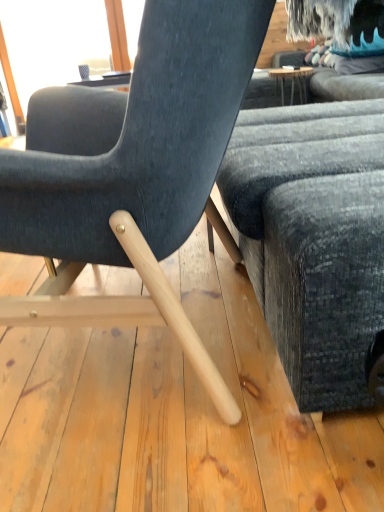
Question: Can you confirm if dark gray fabric couch at right is bigger than velvet dark blue chair at center?

Choices:
 (A) no
 (B) yes

Answer: (B)

Question: From the image's perspective, is dark gray fabric couch at right on velvet dark blue chair at center?

Choices:
 (A) yes
 (B) no

Answer: (A)

Question: Is dark gray fabric couch at right smaller than velvet dark blue chair at center?

Choices:
 (A) no
 (B) yes

Answer: (A)

Question: Is dark gray fabric couch at right taller than velvet dark blue chair at center?

Choices:
 (A) yes
 (B) no

Answer: (B)

Question: Does dark gray fabric couch at right appear on the left side of velvet dark blue chair at center?

Choices:
 (A) no
 (B) yes

Answer: (A)

Question: Is dark gray fabric couch at right outside of velvet dark blue chair at center?

Choices:
 (A) no
 (B) yes

Answer: (B)

Question: Are velvet dark blue chair at center and dark gray fabric couch at right beside each other?

Choices:
 (A) yes
 (B) no

Answer: (B)

Question: Can you confirm if velvet dark blue chair at center is wider than dark gray fabric couch at right?

Choices:
 (A) yes
 (B) no

Answer: (A)

Question: From the image's perspective, is velvet dark blue chair at center above dark gray fabric couch at right?

Choices:
 (A) no
 (B) yes

Answer: (A)

Question: From the image's perspective, is velvet dark blue chair at center located beneath dark gray fabric couch at right?

Choices:
 (A) no
 (B) yes

Answer: (B)

Question: Considering the relative positions of velvet dark blue chair at center and dark gray fabric couch at right in the image provided, is velvet dark blue chair at center in front of dark gray fabric couch at right?

Choices:
 (A) no
 (B) yes

Answer: (B)

Question: From a real-world perspective, is velvet dark blue chair at center located higher than dark gray fabric couch at right?

Choices:
 (A) no
 (B) yes

Answer: (B)

Question: From a real-world perspective, relative to velvet dark blue chair at center, is dark gray fabric couch at right vertically above or below?

Choices:
 (A) below
 (B) above

Answer: (A)